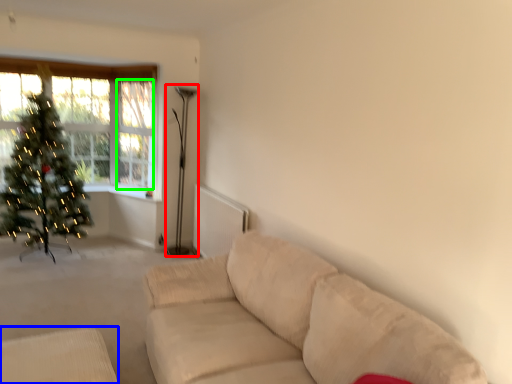
Question: Which object is the closest to the lamp (highlighted by a red box)? Choose among these: furniture (highlighted by a blue box) or window screen (highlighted by a green box).

Choices:
 (A) furniture
 (B) window screen

Answer: (B)